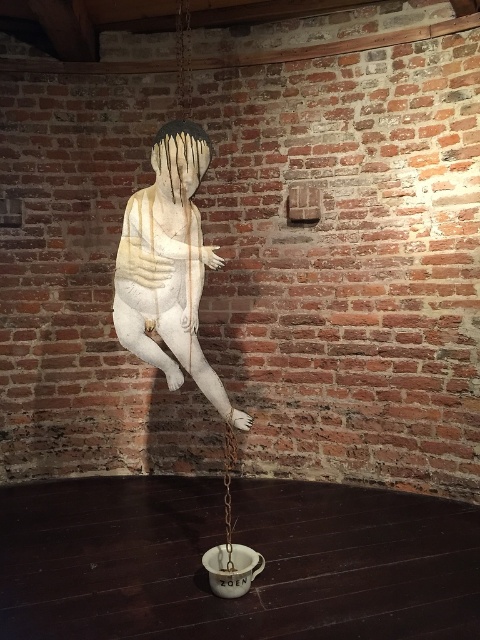
Does point (156, 198) come in front of point (178, 68)?

Yes, point (156, 198) is closer to viewer.

Which is below, white matte sculpture at center or white matte swing at center?

white matte swing at center is lower down.

Where is `white matte sculpture at center`? white matte sculpture at center is located at coordinates (171, 266).